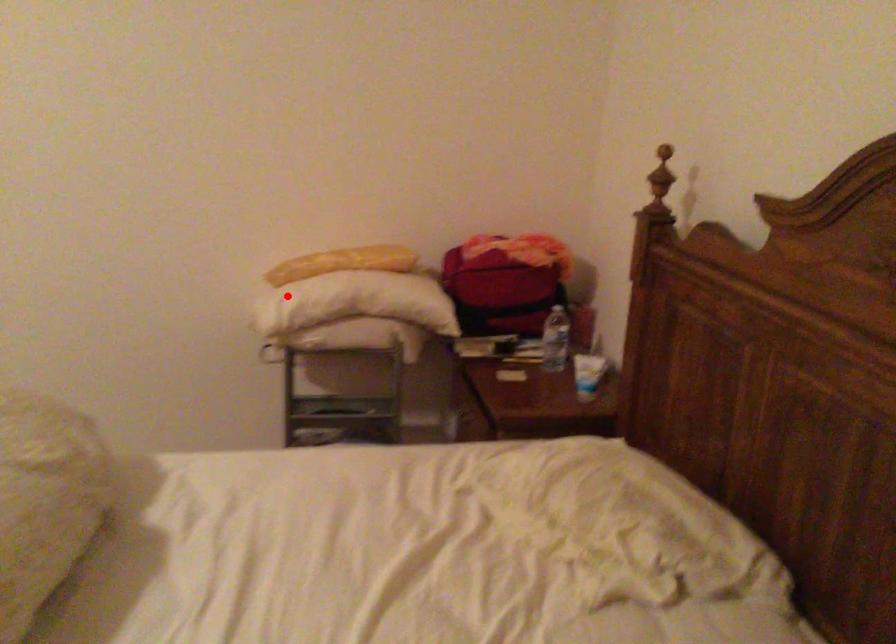
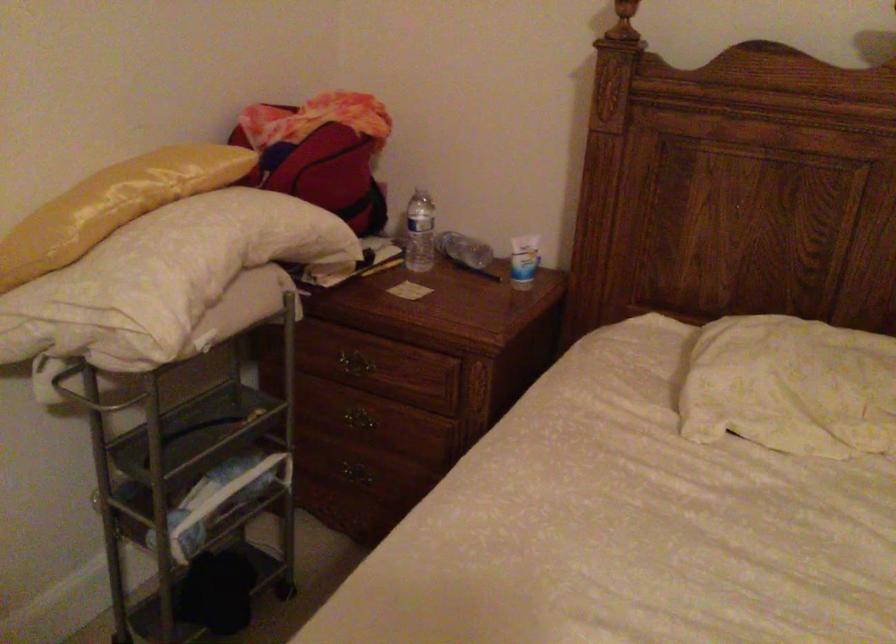
Question: I am providing you with two images of the same scene from different viewpoints. In image1, a red point is highlighted. Considering the same 3D point in image2, which of the following is correct?

Choices:
 (A) It is closer
 (B) It is farther

Answer: (A)